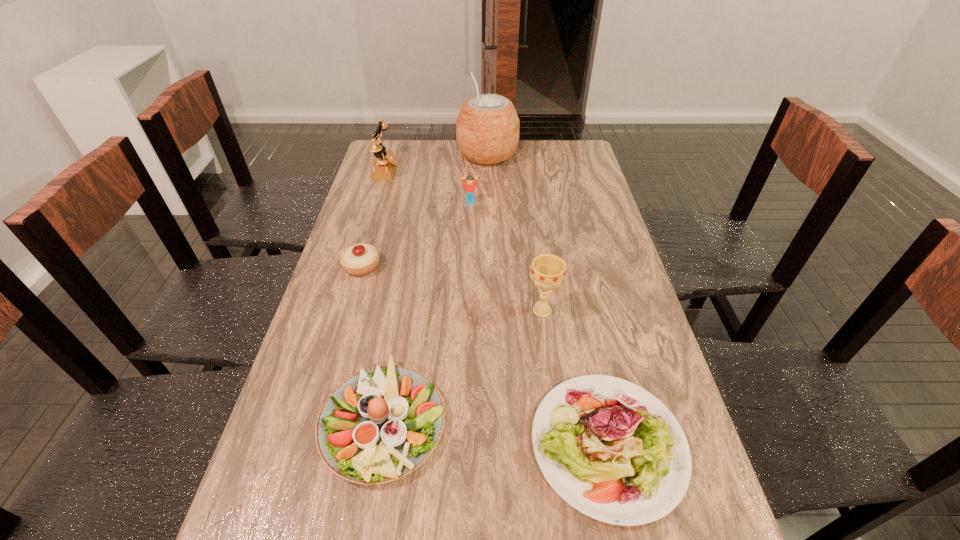
Identify the location of unoccupied position between the telephone and the fourth nearest object. (374, 218).

Locate which object is the fifth closest to the fifth nearest object. Please provide its 2D coordinates. Your answer should be formatted as a tuple, i.e. [(x, y)], where the tuple contains the x and y coordinates of a point satisfying the conditions above.

[(380, 424)]

The image size is (960, 540). I want to click on the fifth closest object to the shorter salad plate, so click(x=384, y=166).

At what (x,y) coordinates should I click in order to perform the action: click on vacant space that satisfies the following two spatial constraints: 1. on the back side of the pastry; 2. on the dial of the telephone. Please return your answer as a coordinate pair (x, y). The height and width of the screenshot is (540, 960). Looking at the image, I should click on (389, 170).

I want to click on free location that satisfies the following two spatial constraints: 1. on the front side of the fifth farthest object; 2. on the left side of the shortest object, so click(561, 445).